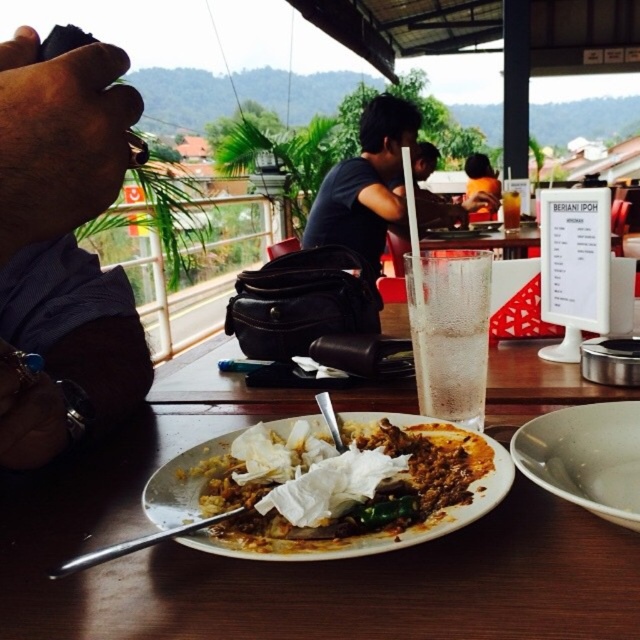
At what (x,y) coordinates should I click in order to perform the action: click on white glossy plate at center. Please return your answer as a coordinate pair (x, y). This screenshot has width=640, height=640. Looking at the image, I should click on (300, 563).

Is point (241, 612) positioned before point (406, 541)?

That is True.

This screenshot has height=640, width=640. What are the coordinates of `white glossy plate at center` in the screenshot? It's located at (300, 563).

Where is `matte black bag at center`? This screenshot has width=640, height=640. matte black bag at center is located at coordinates (481, 184).

From the picture: Between matte black bag at center and clear glass beverage at center, which one appears on the left side from the viewer's perspective?

Positioned to the left is clear glass beverage at center.

The image size is (640, 640). What do you see at coordinates (481, 184) in the screenshot?
I see `matte black bag at center` at bounding box center [481, 184].

In order to click on matte black bag at center in this screenshot , I will do `click(481, 184)`.

Is the position of clear glass at center more distant than that of clear glass beverage at center?

No, clear glass at center is closer to the viewer.

Between clear glass at center and clear glass beverage at center, which one has more height?

clear glass beverage at center

This screenshot has width=640, height=640. What do you see at coordinates (449, 332) in the screenshot?
I see `clear glass at center` at bounding box center [449, 332].

Find the location of a particular element. This screenshot has width=640, height=640. clear glass at center is located at coordinates tap(449, 332).